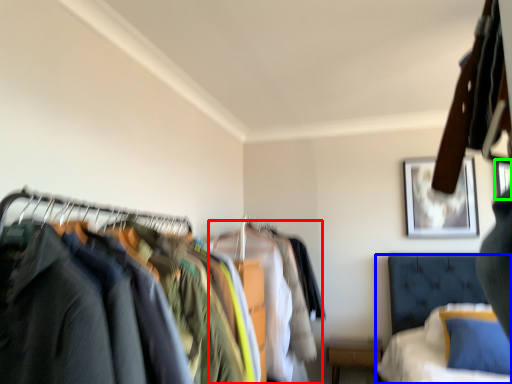
Question: Based on their relative distances, which object is farther from clothing (highlighted by a red box)? Choose from bed (highlighted by a blue box) and picture frame (highlighted by a green box).

Choices:
 (A) bed
 (B) picture frame

Answer: (B)